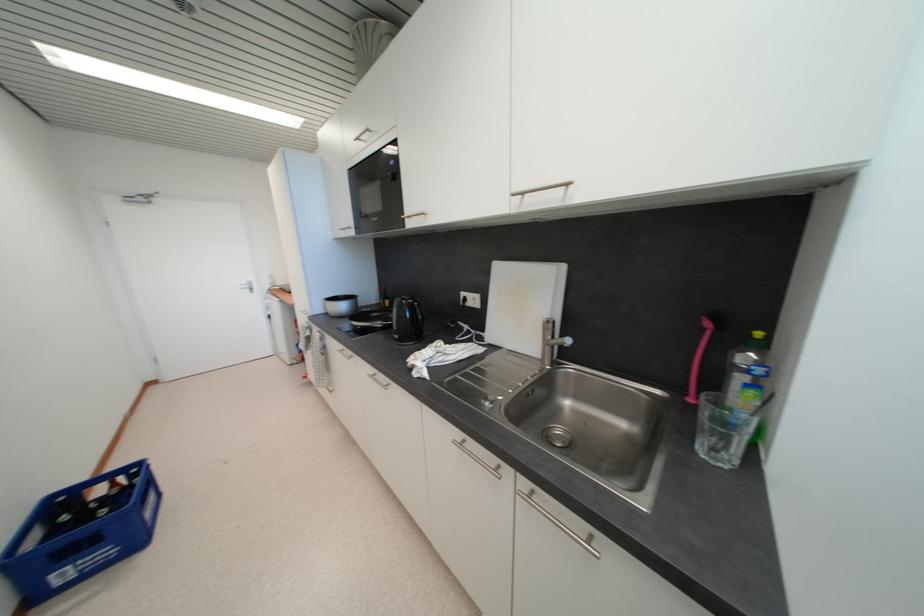
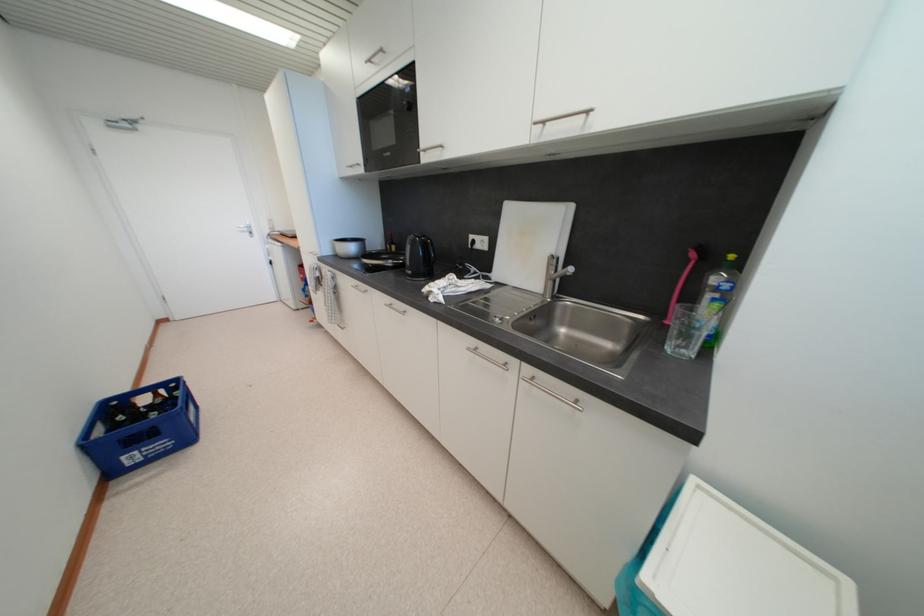
Find the pixel in the second image that matches point (373, 378) in the first image.

(391, 307)